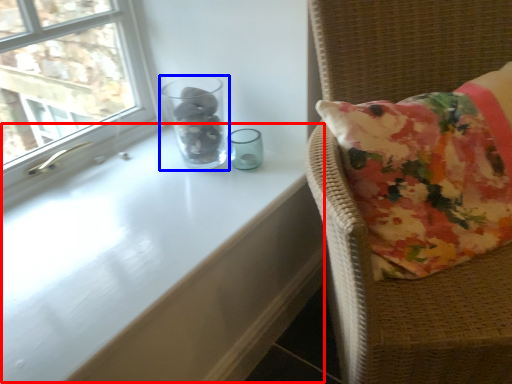
Question: Among these objects, which one is nearest to the camera, table (highlighted by a red box) or glass vase (highlighted by a blue box)?

Choices:
 (A) table
 (B) glass vase

Answer: (A)